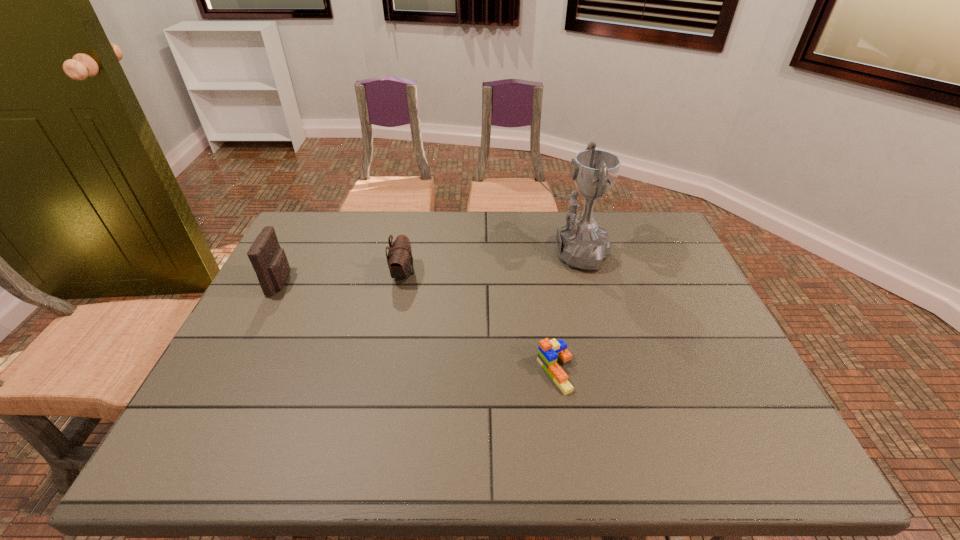
Image resolution: width=960 pixels, height=540 pixels. I want to click on award, so click(581, 243).

This screenshot has width=960, height=540. I want to click on the taller pouch, so click(268, 259).

You are a GUI agent. You are given a task and a screenshot of the screen. Output one action in this format:
    pyautogui.click(x=<x>, y=<y>)
    Task: Click on the leftmost object
    The image size is (960, 540).
    Given the screenshot: What is the action you would take?
    pyautogui.click(x=268, y=259)

At what (x,y) coordinates should I click in order to perform the action: click on the third tallest object. Please return your answer as a coordinate pair (x, y). Looking at the image, I should click on (400, 261).

Locate an element on the screen. The image size is (960, 540). the shorter pouch is located at coordinates (400, 261).

Where is `the nearest object`? This screenshot has width=960, height=540. the nearest object is located at coordinates (549, 351).

Where is `Lego`? This screenshot has height=540, width=960. Lego is located at coordinates (549, 351).

The width and height of the screenshot is (960, 540). I want to click on vacant region located 0.270m on the side with emblem of the tallest object, so tap(446, 253).

I want to click on free location located on the side with emblem of the tallest object, so click(x=421, y=253).

Find the location of `vacant region located on the side with emblem of the tallest object`. vacant region located on the side with emblem of the tallest object is located at coordinates (444, 253).